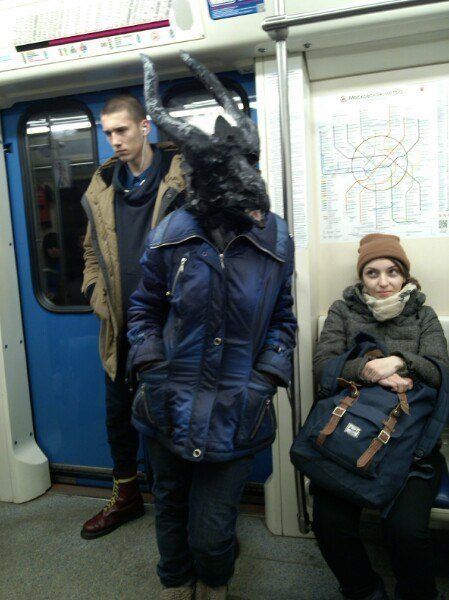
What are the coordinates of `windows` in the screenshot? It's located at (64, 167), (198, 107).